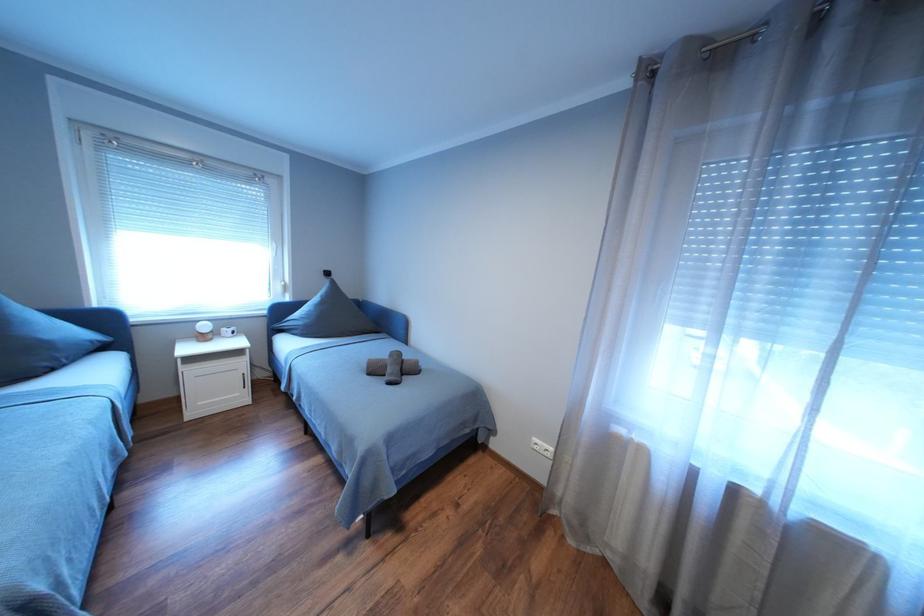
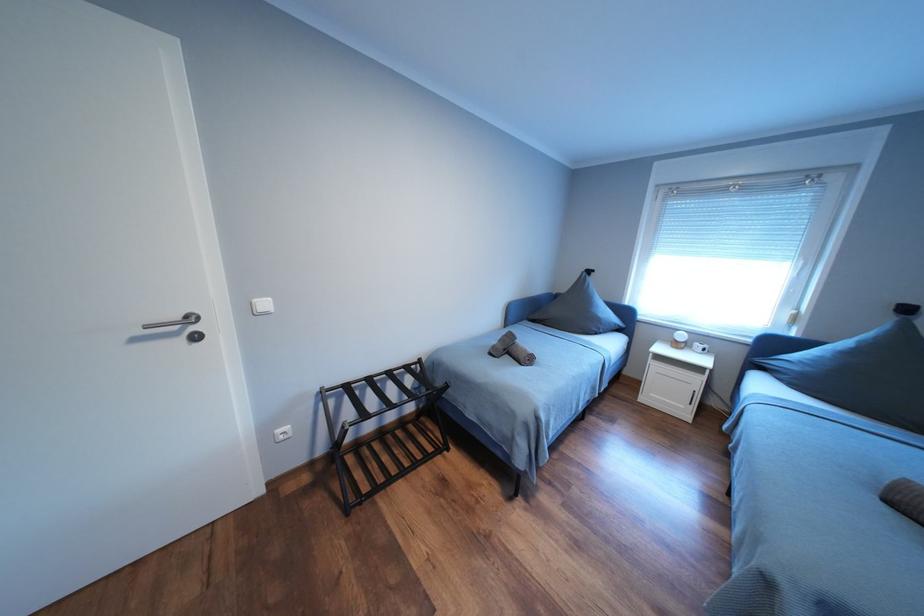
Question: The images are taken continuously from a first-person perspective. In which direction is your viewpoint rotating?

Choices:
 (A) Left
 (B) Right
 (C) Up
 (D) Down

Answer: (A)